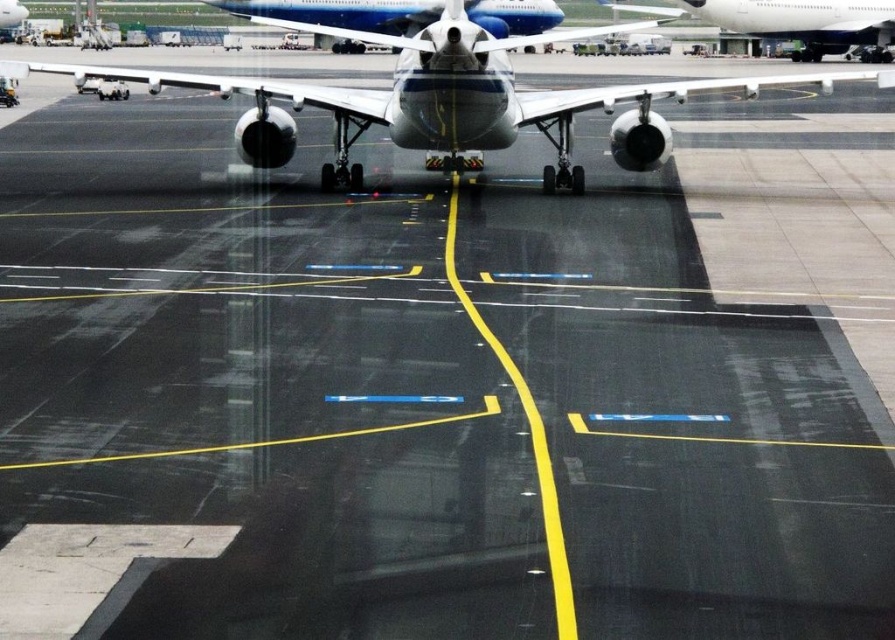
Question: Can you confirm if metallic gray airplane at center is smaller than white glossy airplane at upper right?

Choices:
 (A) no
 (B) yes

Answer: (A)

Question: Is metallic gray airplane at center to the right of white glossy airplane at upper right from the viewer's perspective?

Choices:
 (A) yes
 (B) no

Answer: (B)

Question: Which point is closer to the camera?

Choices:
 (A) white glossy airplane at upper right
 (B) metallic gray airplane at center

Answer: (B)

Question: Is metallic gray airplane at center further to camera compared to white glossy airplane at upper right?

Choices:
 (A) no
 (B) yes

Answer: (A)